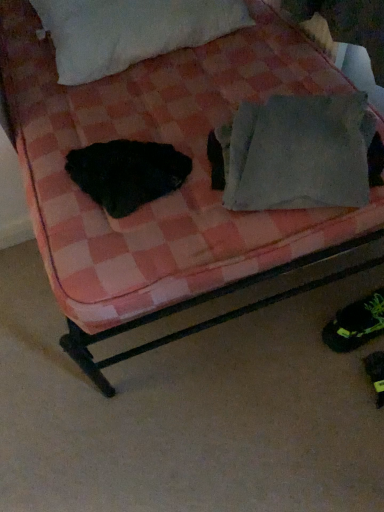
Question: Is black fuzzy animal at left in front of or behind white fluffy pillow at upper center, which ranks as the first pillow in back-to-front order, in the image?

Choices:
 (A) behind
 (B) front

Answer: (B)

Question: Would you say black fuzzy animal at left is to the left or to the right of white fluffy pillow at upper center, the second pillow when ordered from front to back, in the picture?

Choices:
 (A) left
 (B) right

Answer: (B)

Question: Which of these objects is positioned farthest from the gray fabric pillow at upper right, the second pillow positioned from the top?

Choices:
 (A) black fuzzy animal at left
 (B) green synthetic shoe at lower right
 (C) white fluffy pillow at upper center, the 2th pillow from the bottom

Answer: (C)

Question: Estimate the real-world distances between objects in this image. Which object is closer to the white fluffy pillow at upper center, marked as the second pillow in a right-to-left arrangement?

Choices:
 (A) gray fabric pillow at upper right, which appears as the first pillow when ordered from the bottom
 (B) green synthetic shoe at lower right
 (C) black fuzzy animal at left

Answer: (C)